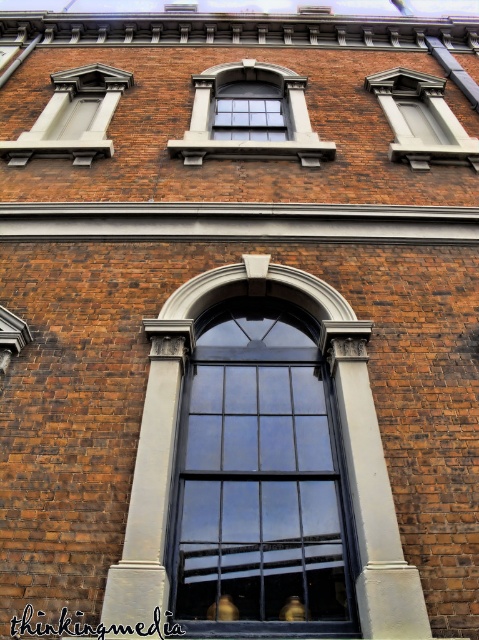
Question: Which point is farther to the camera?

Choices:
 (A) click(101, 84)
 (B) click(296, 339)

Answer: (A)

Question: Is the position of black glass window at center less distant than that of matte gray window at upper right?

Choices:
 (A) yes
 (B) no

Answer: (A)

Question: Can you confirm if black glass window at center is positioned to the left of matte gray window at upper right?

Choices:
 (A) yes
 (B) no

Answer: (A)

Question: Is clear glass window at upper center thinner than matte gray window at upper right?

Choices:
 (A) yes
 (B) no

Answer: (B)

Question: Among these objects, which one is nearest to the camera?

Choices:
 (A) clear glass window at upper center
 (B) black glass window at center
 (C) matte gray window at upper left

Answer: (B)

Question: Which of the following is the closest to the observer?

Choices:
 (A) (317, 456)
 (B) (100, 92)

Answer: (A)